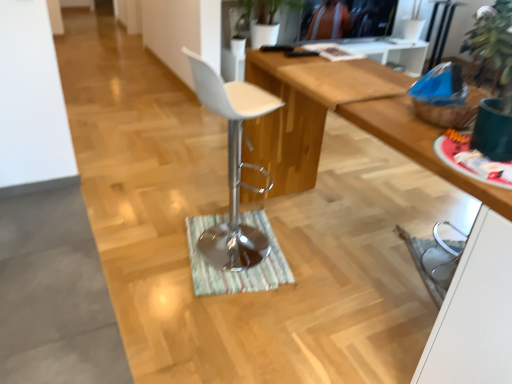
Describe the element at coordinates (475, 311) in the screenshot. The height and width of the screenshot is (384, 512). I see `white glossy cabinet at lower right` at that location.

This screenshot has width=512, height=384. I want to click on green striped mat at center, so click(236, 271).

Describe the element at coordinates (347, 19) in the screenshot. The width and height of the screenshot is (512, 384). I see `matte black television at upper center` at that location.

You are a GUI agent. You are given a task and a screenshot of the screen. Output one action in this format:
    pyautogui.click(x=<x>, y=<y>)
    Task: Click on the wooden desk at center
    Image resolution: width=512 pixels, height=384 pixels.
    Given the screenshot: What is the action you would take?
    pyautogui.click(x=413, y=160)

Between white matte bar stool at center and green striped mat at center, which one has smaller size?

Smaller between the two is green striped mat at center.

In the image, is white matte bar stool at center positioned in front of or behind green striped mat at center?

white matte bar stool at center is positioned closer to the viewer than green striped mat at center.

From a real-world perspective, which is physically below, white matte bar stool at center or green striped mat at center?

From a 3D spatial view, green striped mat at center is below.

How much distance is there between matte black television at upper center and white glossy cabinet at lower right?

matte black television at upper center and white glossy cabinet at lower right are 3.70 meters apart.

How many degrees apart are the facing directions of matte black television at upper center and white glossy cabinet at lower right?

91.8 degrees.

From the image's perspective, does matte black television at upper center appear higher than white glossy cabinet at lower right?

Yes, from the image's perspective, matte black television at upper center is over white glossy cabinet at lower right.

Is matte black television at upper center to the left of white glossy cabinet at lower right from the viewer's perspective?

No, matte black television at upper center is not to the left of white glossy cabinet at lower right.

Between green striped mat at center and white matte bar stool at center, which one appears on the right side from the viewer's perspective?

white matte bar stool at center is more to the right.

Is green striped mat at center looking in the opposite direction of white matte bar stool at center?

No, green striped mat at center is not facing the opposite direction of white matte bar stool at center.

Considering the relative sizes of green striped mat at center and white matte bar stool at center in the image provided, is green striped mat at center bigger than white matte bar stool at center?

No, green striped mat at center is not bigger than white matte bar stool at center.

Considering the relative sizes of green striped mat at center and white matte bar stool at center in the image provided, is green striped mat at center taller than white matte bar stool at center?

Incorrect, the height of green striped mat at center is not larger of that of white matte bar stool at center.

Is white glossy cabinet at lower right taller than wooden desk at center?

No.

From a real-world perspective, is white glossy cabinet at lower right located beneath wooden desk at center?

Yes, from a real-world perspective, white glossy cabinet at lower right is beneath wooden desk at center.

Is point (499, 323) positioned before point (407, 106)?

Yes, it is.

Between white glossy cabinet at lower right and wooden desk at center, which one has larger size?

wooden desk at center.

Would you say white glossy cabinet at lower right is inside or outside matte black television at upper center?

white glossy cabinet at lower right is not enclosed by matte black television at upper center.

Based on the photo, does white glossy cabinet at lower right turn towards matte black television at upper center?

No.

Which object is positioned more to the right, white glossy cabinet at lower right or matte black television at upper center?

matte black television at upper center.

Which of these two, white glossy cabinet at lower right or matte black television at upper center, is wider?

white glossy cabinet at lower right.

Between point (373, 9) and point (337, 82), which one is positioned behind?

The point (373, 9) is farther from the camera.

From the image's perspective, is matte black television at upper center beneath wooden desk at center?

Actually, matte black television at upper center appears above wooden desk at center in the image.

Which of these two, matte black television at upper center or wooden desk at center, is wider?

With larger width is wooden desk at center.

From a real-world perspective, which is physically below, matte black television at upper center or wooden desk at center?

wooden desk at center.

From a real-world perspective, between wooden desk at center and white matte bar stool at center, who is vertically lower?

From a 3D spatial view, wooden desk at center is below.

Between wooden desk at center and white matte bar stool at center, which one has larger size?

With larger size is wooden desk at center.

Which object is further away from the camera, wooden desk at center or white matte bar stool at center?

white matte bar stool at center.

Considering the points (433, 344) and (262, 109), which point is behind, point (433, 344) or point (262, 109)?

Point (262, 109)

I want to click on doormat that is below the white matte bar stool at center (from the image's perspective), so click(x=236, y=271).

Locate an element on the screen. The width and height of the screenshot is (512, 384). television above the white glossy cabinet at lower right (from the image's perspective) is located at coordinates (347, 19).

Based on their spatial positions, is white glossy cabinet at lower right or white matte bar stool at center further from wooden desk at center?

Based on the image, white matte bar stool at center appears to be further to wooden desk at center.

Which object lies further to the anchor point matte black television at upper center, white matte bar stool at center or wooden desk at center?

white matte bar stool at center is further to matte black television at upper center.

From the image, which object appears to be farther from white matte bar stool at center, white glossy cabinet at lower right or matte black television at upper center?

Based on the image, matte black television at upper center appears to be further to white matte bar stool at center.

From the image, which object appears to be farther from white matte bar stool at center, white glossy cabinet at lower right or green striped mat at center?

white glossy cabinet at lower right lies further to white matte bar stool at center than the other object.

Looking at the image, which one is located closer to green striped mat at center, matte black television at upper center or white matte bar stool at center?

Among the two, white matte bar stool at center is located nearer to green striped mat at center.

Considering their positions, is green striped mat at center positioned further to white matte bar stool at center than white glossy cabinet at lower right?

white glossy cabinet at lower right lies further to white matte bar stool at center than the other object.

Looking at the image, which one is located further to green striped mat at center, matte black television at upper center or white glossy cabinet at lower right?

Among the two, matte black television at upper center is located further to green striped mat at center.

Based on their spatial positions, is green striped mat at center or white glossy cabinet at lower right further from wooden desk at center?

green striped mat at center.

At what (x,y) coordinates should I click in order to perform the action: click on chair between white glossy cabinet at lower right and green striped mat at center in the front-back direction. Please return your answer as a coordinate pair (x, y). The image size is (512, 384). Looking at the image, I should click on (233, 166).

What are the coordinates of `doormat between white glossy cabinet at lower right and matte black television at upper center along the z-axis` in the screenshot? It's located at point(236,271).

I want to click on desk positioned between white glossy cabinet at lower right and matte black television at upper center from near to far, so pos(413,160).

At what (x,y) coordinates should I click in order to perform the action: click on chair between wooden desk at center and matte black television at upper center in the front-back direction. Please return your answer as a coordinate pair (x, y). This screenshot has width=512, height=384. Looking at the image, I should click on (233, 166).